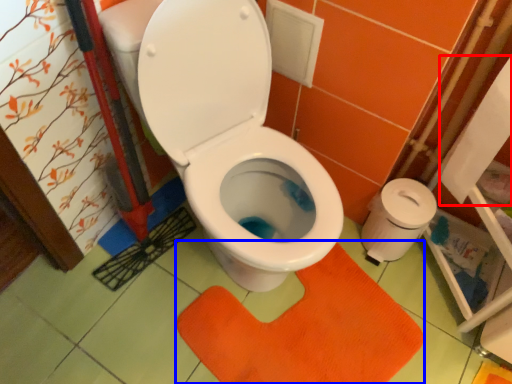
Question: Among these objects, which one is nearest to the camera, toilet paper (highlighted by a red box) or doormat (highlighted by a blue box)?

Choices:
 (A) toilet paper
 (B) doormat

Answer: (A)